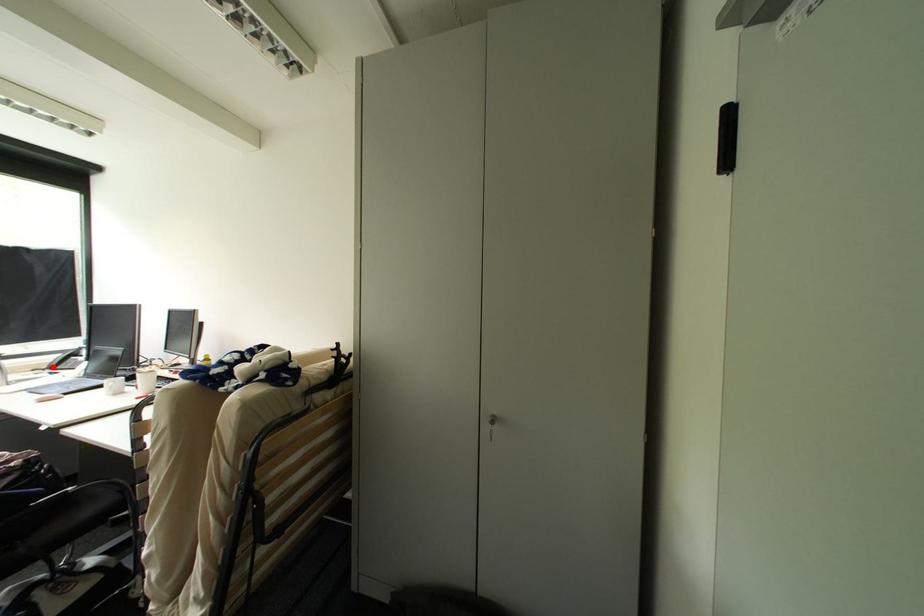
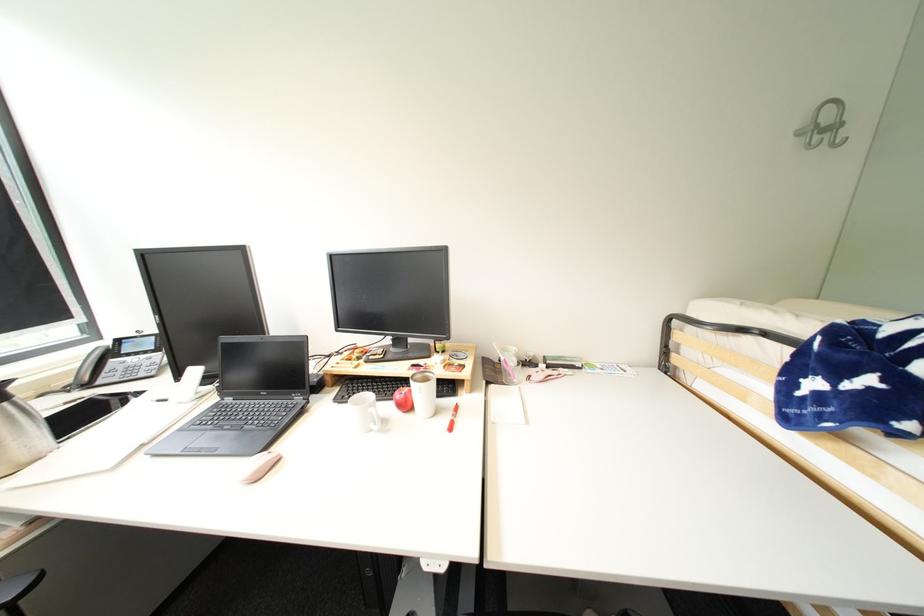
Where in the second image is the point corresponding to the highlighted location from the first image?

(75, 384)